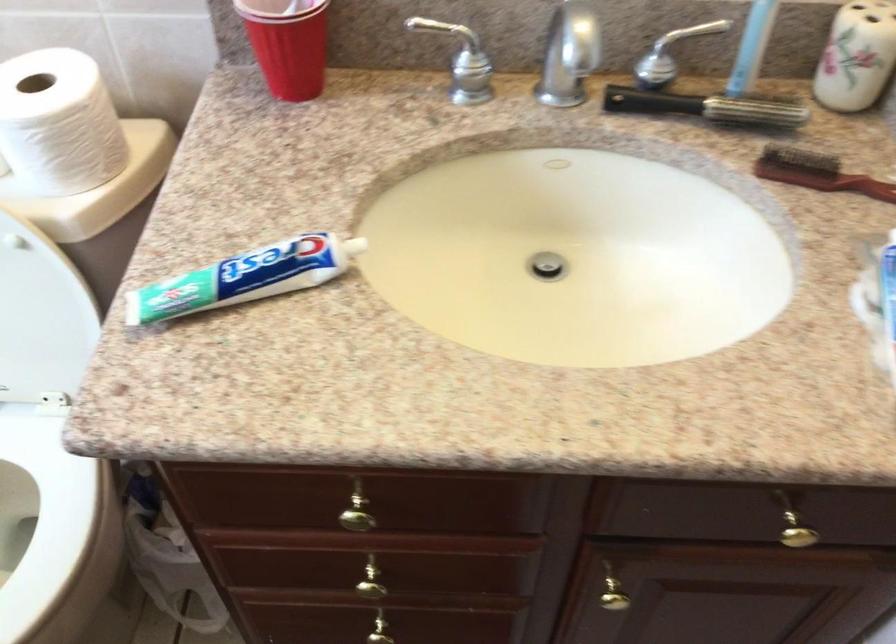
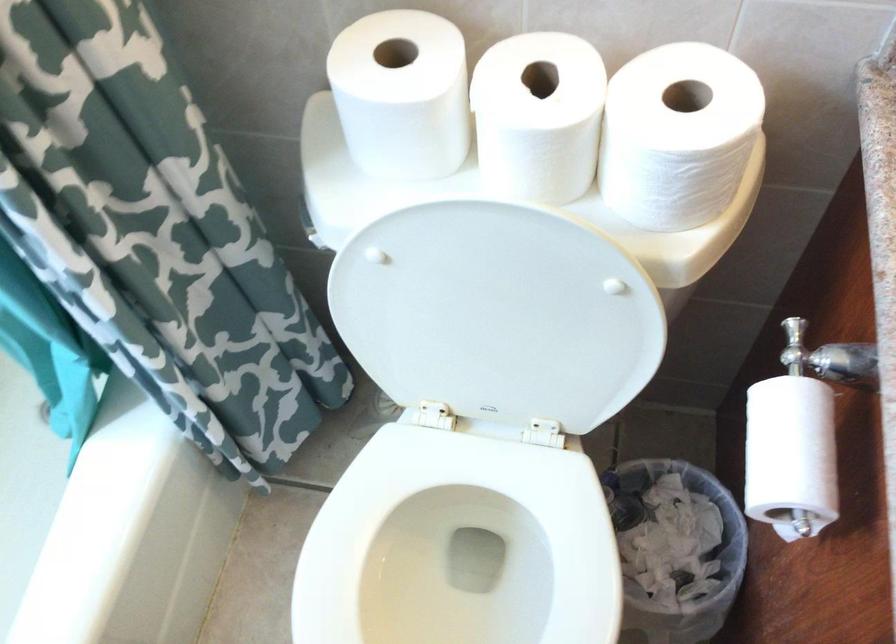
Question: In a continuous first-person perspective shot, in which direction is the camera moving?

Choices:
 (A) Left
 (B) Right
 (C) Forward
 (D) Backward

Answer: (A)